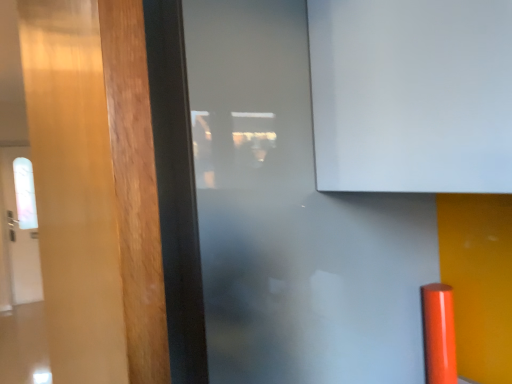
I want to click on white glossy door at left, so click(x=18, y=231).

What do you see at coordinates (18, 231) in the screenshot?
I see `white glossy door at left` at bounding box center [18, 231].

You are a GUI agent. You are given a task and a screenshot of the screen. Output one action in this format:
    pyautogui.click(x=<x>, y=<y>)
    Task: Click on the white glossy door at left
    
    Given the screenshot: What is the action you would take?
    pyautogui.click(x=18, y=231)